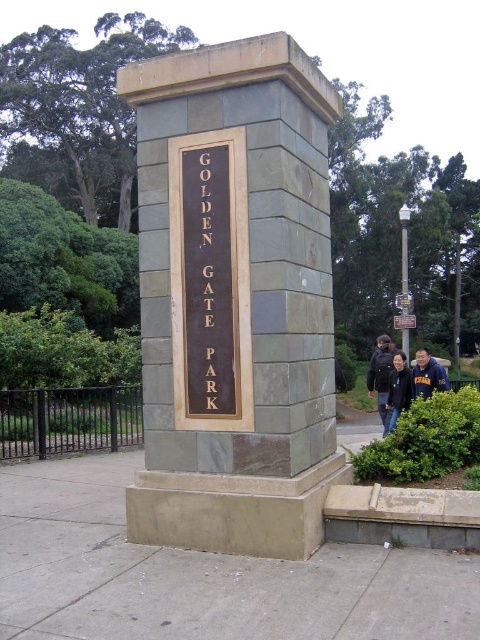
Which is behind, point (142, 326) or point (186, 301)?

Point (142, 326)

Identify the location of gray stone sign at center. The width and height of the screenshot is (480, 640). (237, 300).

Is gray stone sign at center wider than dark blue jacket at right?

No, gray stone sign at center is not wider than dark blue jacket at right.

Between gray stone sign at center and dark blue jacket at right, which one appears on the right side from the viewer's perspective?

dark blue jacket at right

Describe the element at coordinates (237, 300) in the screenshot. The width and height of the screenshot is (480, 640). I see `gray stone sign at center` at that location.

You are a GUI agent. You are given a task and a screenshot of the screen. Output one action in this format:
    pyautogui.click(x=<x>, y=<y>)
    Task: Click on the gray stone sign at center
    
    Given the screenshot: What is the action you would take?
    237,300

Does gold polished metal sign at center appear over dark blue jacket at right?

Yes, gold polished metal sign at center is above dark blue jacket at right.

What do you see at coordinates (210, 282) in the screenshot? This screenshot has height=640, width=480. I see `gold polished metal sign at center` at bounding box center [210, 282].

Locate an element on the screen. This screenshot has width=480, height=640. gold polished metal sign at center is located at coordinates [x=210, y=282].